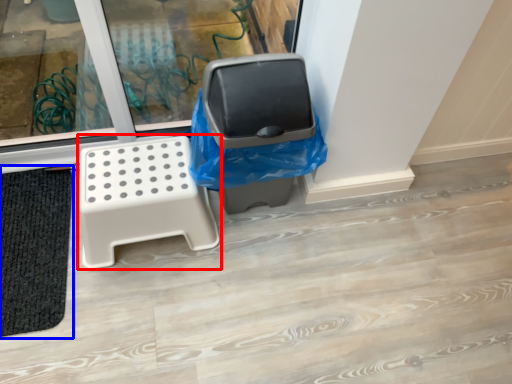
Question: Which point is closer to the camera, furniture (highlighted by a red box) or bath mat (highlighted by a blue box)?

Choices:
 (A) furniture
 (B) bath mat

Answer: (A)